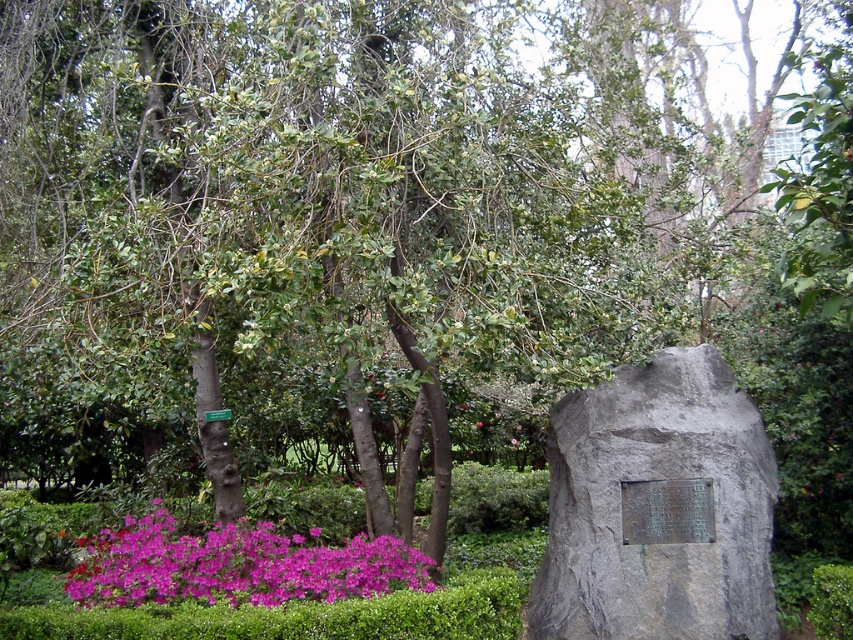
Between gray stone plaque at right and purple matte flowers at lower left, which one is positioned lower?

Positioned lower is purple matte flowers at lower left.

Between point (566, 508) and point (114, 573), which one is positioned behind?

The point (566, 508) is behind.

Is point (703, 573) in front of point (242, 545)?

Yes, point (703, 573) is closer to viewer.

This screenshot has width=853, height=640. I want to click on gray stone plaque at right, so click(659, 508).